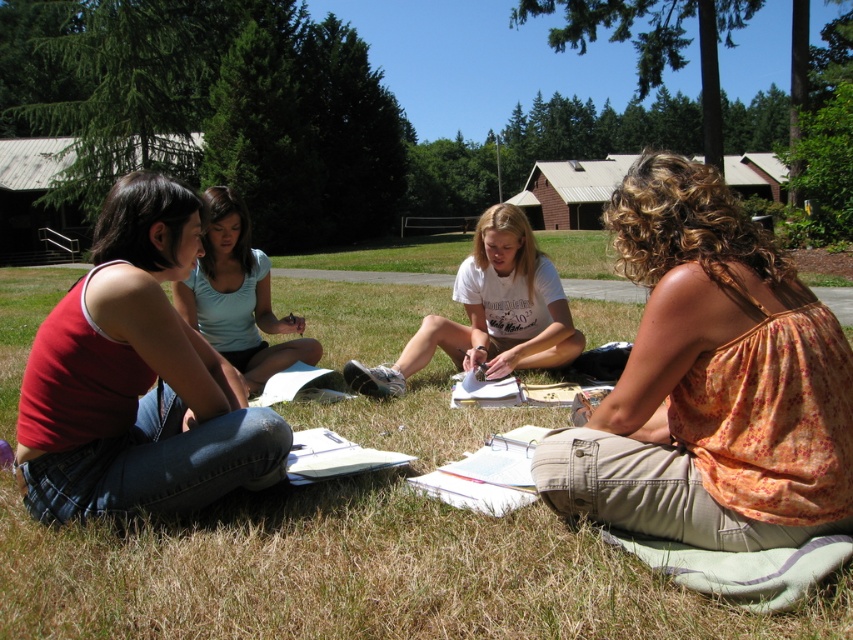
Question: Considering the relative positions of floral cotton tank top at lower right and matte red tank top at left in the image provided, where is floral cotton tank top at lower right located with respect to matte red tank top at left?

Choices:
 (A) above
 (B) below

Answer: (B)

Question: Among these points, which one is nearest to the camera?

Choices:
 (A) [297, 592]
 (B) [281, 323]

Answer: (A)

Question: Considering the relative positions of green grass at lower center and matte red tank top at left in the image provided, where is green grass at lower center located with respect to matte red tank top at left?

Choices:
 (A) above
 (B) below

Answer: (A)

Question: Does green grass at lower center appear over matte red tank top at left?

Choices:
 (A) yes
 (B) no

Answer: (A)

Question: Among these points, which one is nearest to the camera?

Choices:
 (A) (431, 296)
 (B) (839, 426)
 (C) (245, 364)

Answer: (B)

Question: Which is nearer to the light blue cotton shirt at center?

Choices:
 (A) floral cotton tank top at lower right
 (B) matte red tank top at left

Answer: (B)